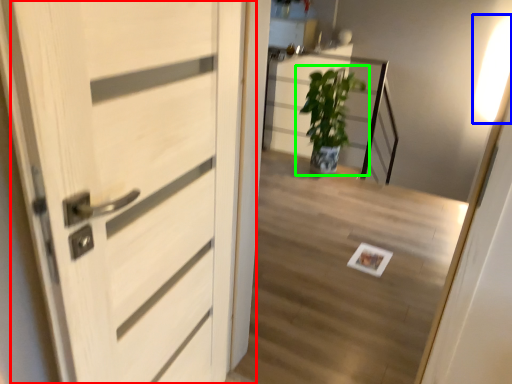
Question: Which object is the closest to the door (highlighted by a red box)? Choose among these: light (highlighted by a blue box) or houseplant (highlighted by a green box).

Choices:
 (A) light
 (B) houseplant

Answer: (B)